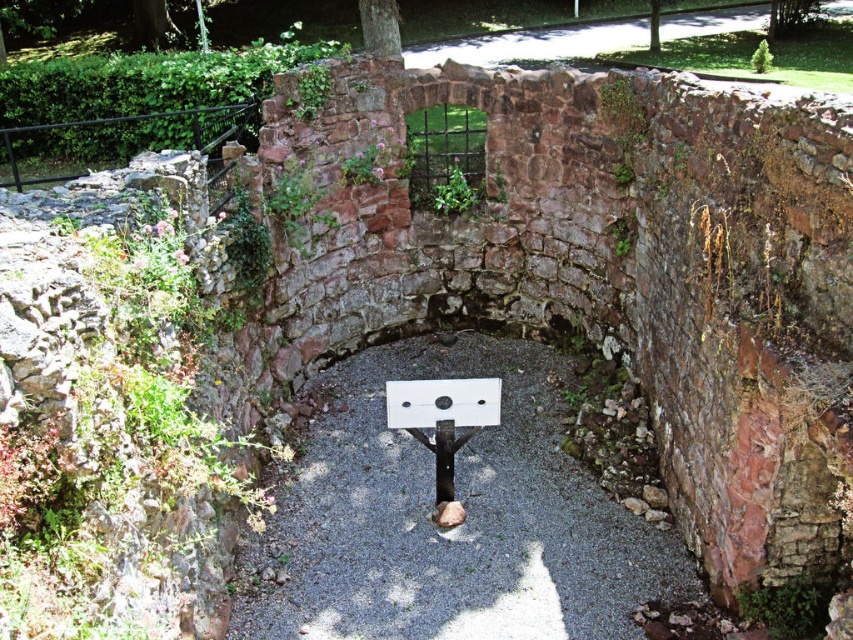
Is point (448, 429) positioned behind point (396, 420)?

Yes, point (448, 429) is farther from viewer.

At what (x,y) coordinates should I click in order to perform the action: click on white matte signpost at center. Please return your answer as a coordinate pair (x, y). Looking at the image, I should click on (444, 424).

Is gray gravel at center shorter than white matte signpost at center?

In fact, gray gravel at center may be taller than white matte signpost at center.

Which is behind, point (318, 605) or point (440, 499)?

Point (440, 499)

Who is more distant from viewer, (271, 598) or (440, 496)?

Positioned behind is point (440, 496).

Where is `gray gravel at center`? Image resolution: width=853 pixels, height=640 pixels. gray gravel at center is located at coordinates (451, 528).

Measure the distance between gray gravel at center and camera.

They are 4.70 meters apart.

Who is lower down, gray gravel at center or white plastic sign at center?

gray gravel at center is lower down.

Where is `gray gravel at center`? The width and height of the screenshot is (853, 640). gray gravel at center is located at coordinates (451, 528).

Locate an element on the screen. This screenshot has height=640, width=853. gray gravel at center is located at coordinates (451, 528).